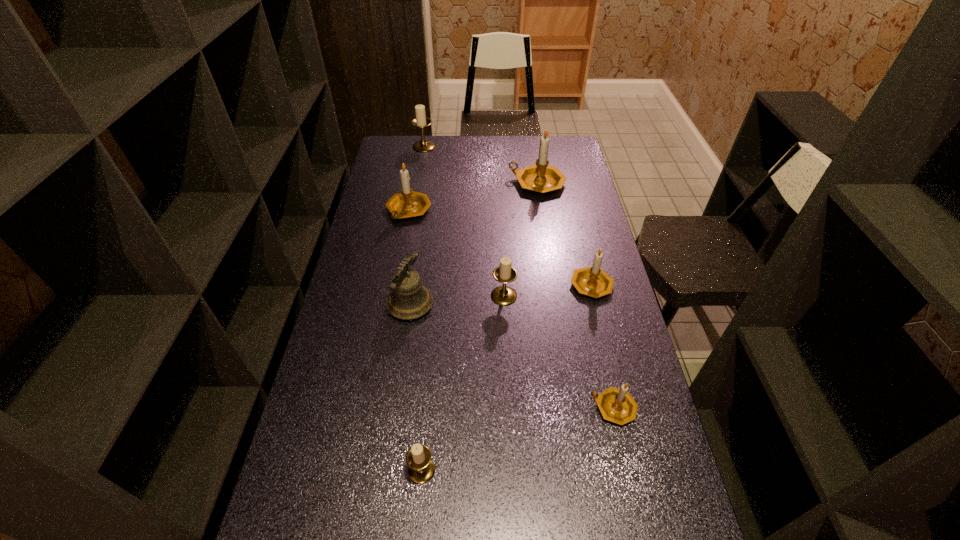
Identify the location of gold candle holder that stands as the second closest to the second nearest gold candle holder. (540, 177).

I want to click on white candle holder that is the second closest to the fifth candle holder from right to left, so click(x=421, y=120).

The width and height of the screenshot is (960, 540). I want to click on white candle holder that is the closest one to the nearest candle holder, so click(503, 295).

Locate an element on the screen. The height and width of the screenshot is (540, 960). free space in the image that satisfies the following two spatial constraints: 1. on the back side of the rightmost white candle holder; 2. on the left side of the bell is located at coordinates (412, 296).

Where is `free space in the image that satisfies the following two spatial constraints: 1. on the back side of the third biggest gold candle holder; 2. on the left side of the smallest white candle holder`? free space in the image that satisfies the following two spatial constraints: 1. on the back side of the third biggest gold candle holder; 2. on the left side of the smallest white candle holder is located at coordinates (439, 284).

Locate an element on the screen. free space that satisfies the following two spatial constraints: 1. on the front side of the nearest gold candle holder; 2. on the left side of the biggest gold candle holder is located at coordinates (x=572, y=408).